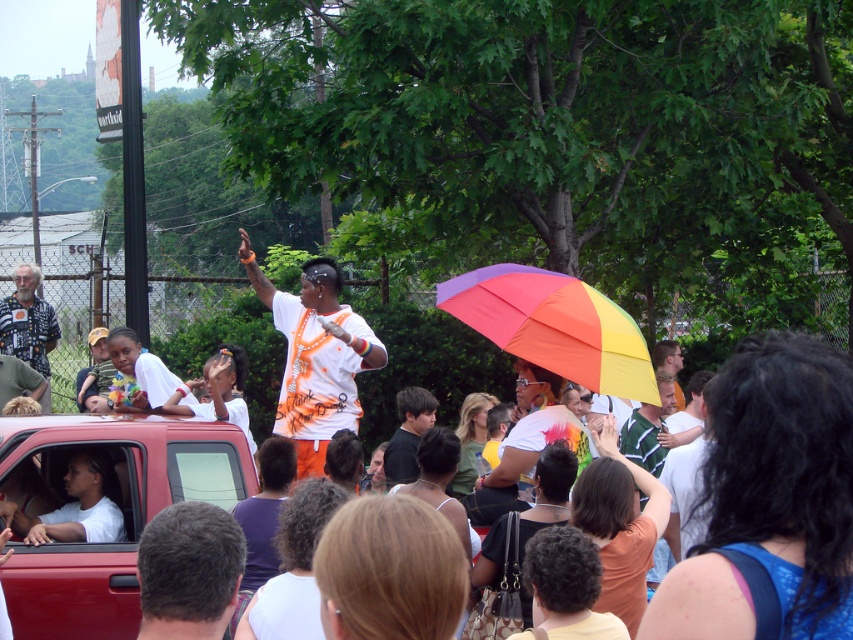
You are a photographer trying to capture a wide shot of the scene. The rainbow fabric umbrella at center and dark brown hair at lower left are both in your frame. Which object will appear wider in the photo?

The rainbow fabric umbrella at center will appear wider in the photo because its width is larger than that of the dark brown hair at lower left.

You are a photographer at the parade and want to take a photo of both the printed fabric shirt at left and the black matte shirt at center. Which shirt should you focus on first if you want to capture them in order from left to right?

The printed fabric shirt at left should be focused on first since it is positioned to the left of the black matte shirt at center.